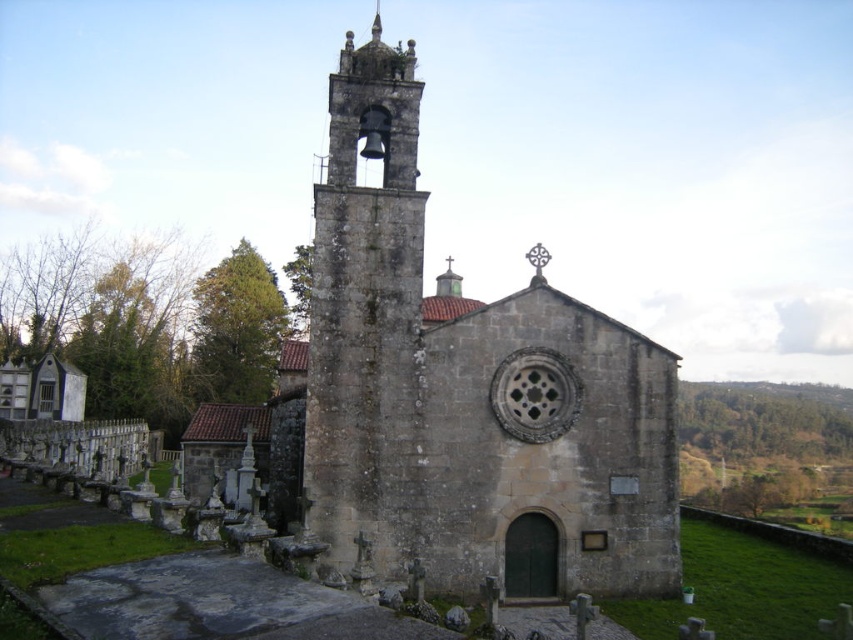
Question: Is stone church at center below stone bell tower at center?

Choices:
 (A) yes
 (B) no

Answer: (A)

Question: Is stone church at center to the left of stone bell tower at center from the viewer's perspective?

Choices:
 (A) no
 (B) yes

Answer: (A)

Question: Which of the following is the closest to the observer?

Choices:
 (A) (399, 337)
 (B) (596, 420)

Answer: (A)

Question: Which point appears farthest from the camera in this image?

Choices:
 (A) (395, 330)
 (B) (380, 275)

Answer: (B)

Question: Which object is farther from the camera taking this photo?

Choices:
 (A) stone church at center
 (B) stone bell tower at center

Answer: (B)

Question: Does stone church at center have a lesser width compared to stone bell tower at center?

Choices:
 (A) yes
 (B) no

Answer: (B)